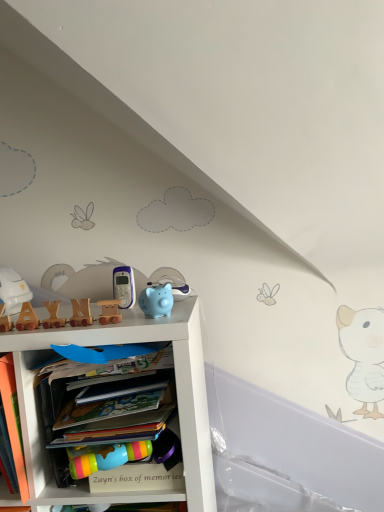
Where is `free space in front of matte plastic phone at center, the sixth toy viewed from the left`? Image resolution: width=384 pixels, height=512 pixels. free space in front of matte plastic phone at center, the sixth toy viewed from the left is located at coordinates (116, 318).